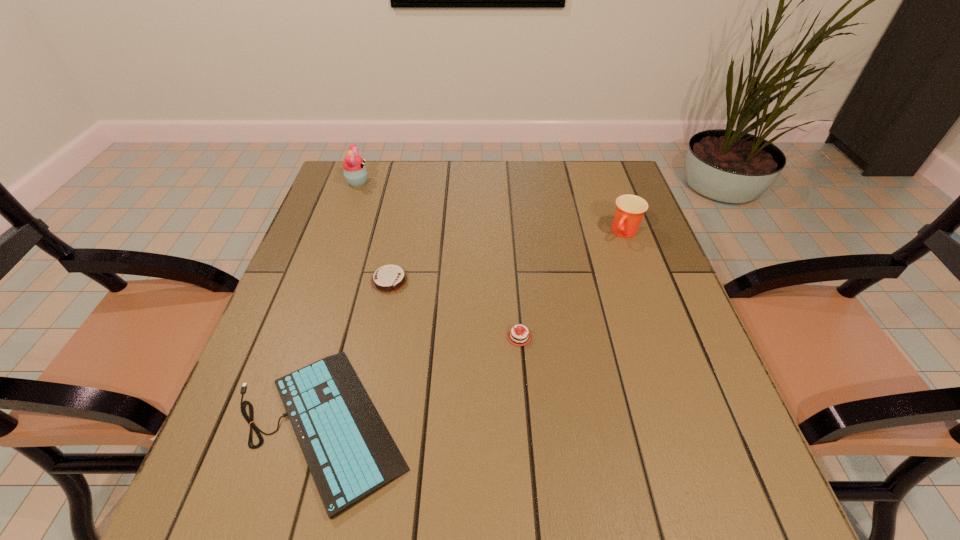
Image resolution: width=960 pixels, height=540 pixels. Identify the location of the tallest object. (355, 172).

Locate an element on the screen. This screenshot has height=540, width=960. the farthest object is located at coordinates (355, 172).

What are the coordinates of `the second tallest object` in the screenshot? It's located at (630, 209).

In order to click on cup in this screenshot , I will do `click(630, 209)`.

Locate an element on the screen. the right chocolate cake is located at coordinates (514, 337).

The width and height of the screenshot is (960, 540). Identify the location of the nearer chocolate cake. (514, 337).

Where is `the third nearest object`? the third nearest object is located at coordinates (388, 279).

Identify the location of the farther chocolate cake. Image resolution: width=960 pixels, height=540 pixels. (388, 279).

You are a GUI agent. You are given a task and a screenshot of the screen. Output one action in this format:
    pyautogui.click(x=<x>, y=<y>)
    Task: Click on the computer keyboard
    This screenshot has width=960, height=540.
    Given the screenshot: What is the action you would take?
    pyautogui.click(x=350, y=453)

Image resolution: width=960 pixels, height=540 pixels. In order to click on vacant space located 0.380m on the face of the cupcake in this screenshot , I will do `click(491, 182)`.